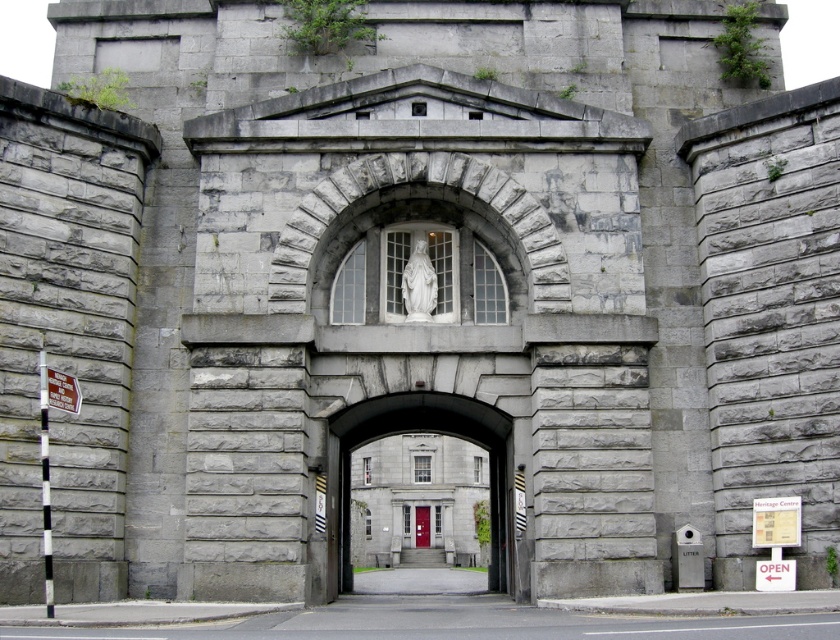
You are a visitor approaching the grand stone archway. You see the black and white striped pole at left and the red matte door at center. Which object is located higher up in the image?

The black and white striped pole at left is positioned over the red matte door at center, so it is located higher up in the image.

You are a visitor approaching the grand stone archway and see the white plastic sign at left and the red matte door at center. Which object is located higher up relative to the other?

The white plastic sign at left is positioned over the red matte door at center, so it is higher up.